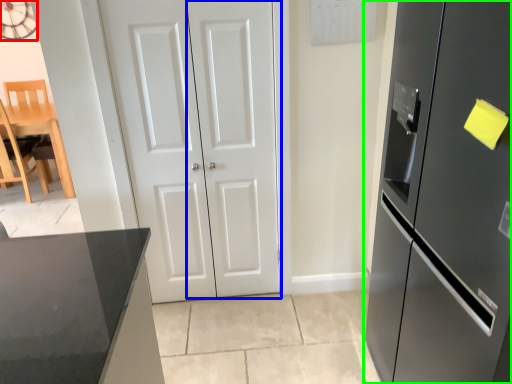
Question: Which is farther away from clock (highlighted by a red box)? door (highlighted by a blue box) or refrigerator (highlighted by a green box)?

Choices:
 (A) door
 (B) refrigerator

Answer: (B)